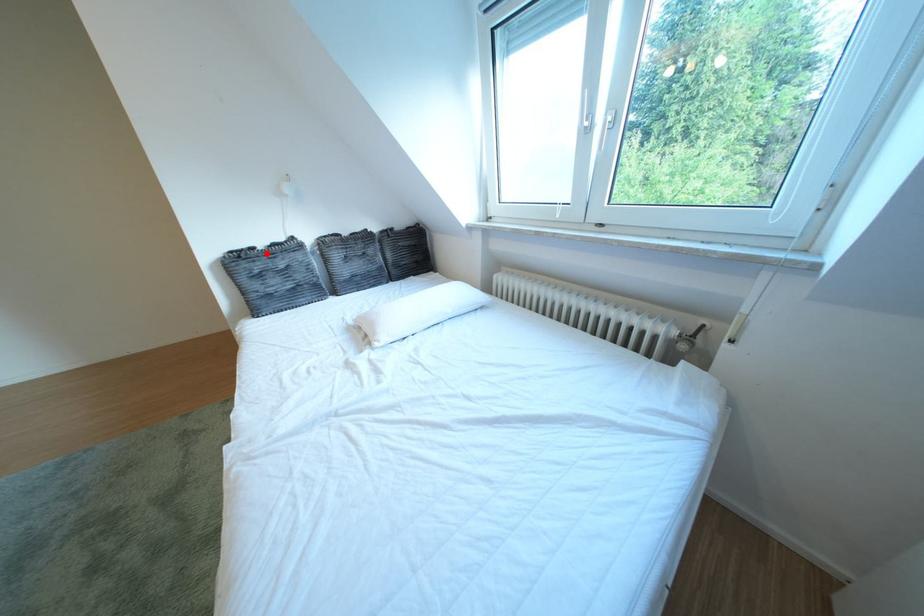
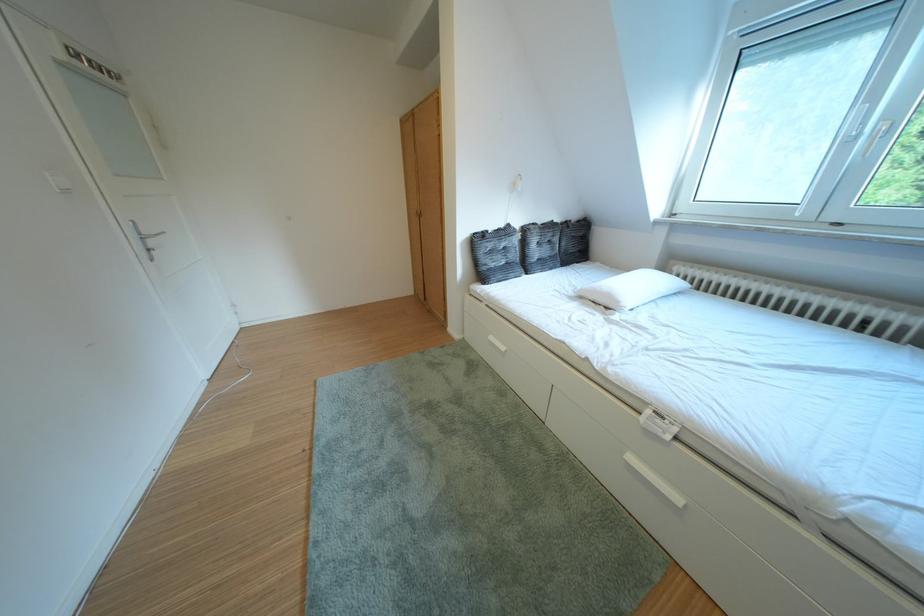
Find the pixel in the second image that matches the highlighted location in the first image.

(500, 237)